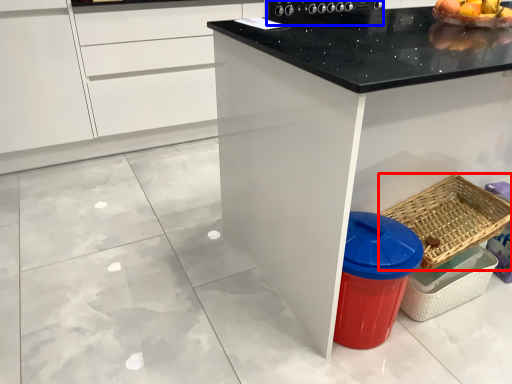
Question: Which of the following is the farthest to the observer, basket (highlighted by a red box) or appliance (highlighted by a blue box)?

Choices:
 (A) basket
 (B) appliance

Answer: (B)